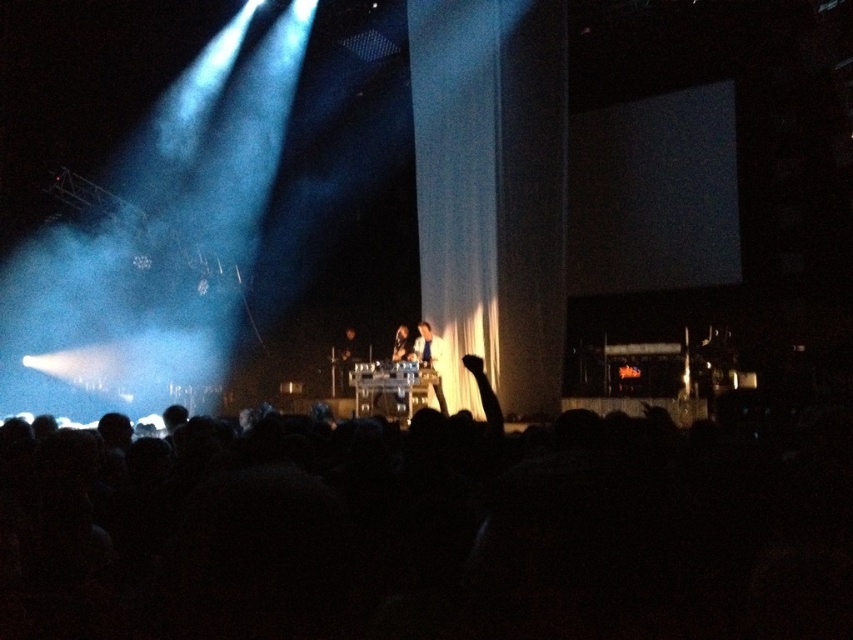
Is black matte crowd at lower center positioned behind shiny black microphone at center?

No.

Does point (375, 449) come in front of point (405, 352)?

Yes, point (375, 449) is in front of point (405, 352).

This screenshot has height=640, width=853. What do you see at coordinates (428, 531) in the screenshot?
I see `black matte crowd at lower center` at bounding box center [428, 531].

In order to click on black matte crowd at lower center in this screenshot , I will do `click(428, 531)`.

Which is behind, point (434, 394) or point (393, 352)?

The point (393, 352) is behind.

Is shiny black jacket at center smaller than shiny black microphone at center?

No.

Does point (424, 340) come farther from viewer compared to point (407, 333)?

No, (424, 340) is in front of (407, 333).

The width and height of the screenshot is (853, 640). In order to click on shiny black jacket at center in this screenshot , I will do `click(428, 360)`.

Which is in front, point (845, 592) or point (421, 369)?

Point (845, 592)

What do you see at coordinates (428, 531) in the screenshot? This screenshot has width=853, height=640. I see `black matte crowd at lower center` at bounding box center [428, 531].

Between point (590, 468) and point (434, 385), which one is positioned in front?

Point (590, 468) is in front.

You are a GUI agent. You are given a task and a screenshot of the screen. Output one action in this format:
    pyautogui.click(x=<x>, y=<y>)
    Task: Click on the black matte crowd at lower center
    
    Given the screenshot: What is the action you would take?
    pyautogui.click(x=428, y=531)